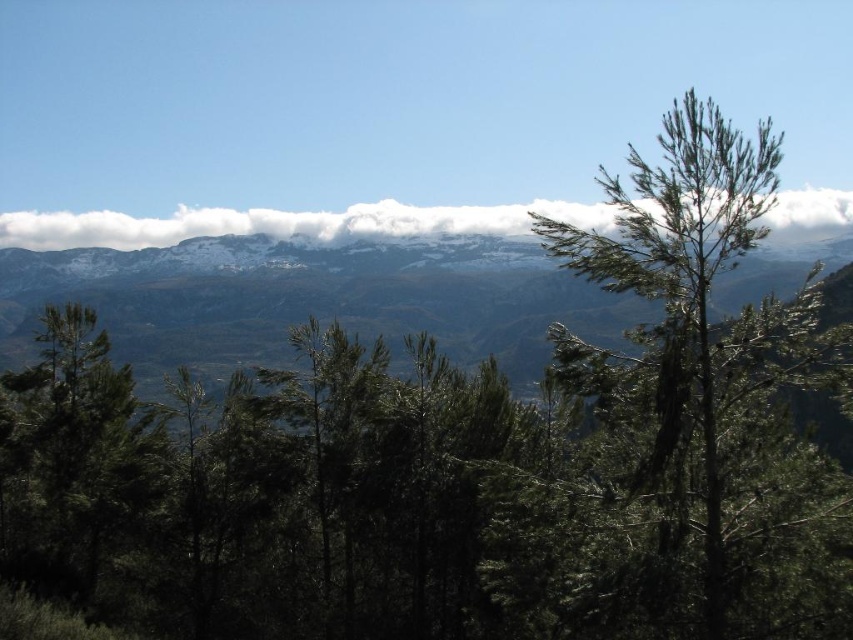
Question: Where is green needle-like tree at right located in relation to white fluffy cloud at upper center in the image?

Choices:
 (A) above
 (B) below

Answer: (A)

Question: Which point is closer to the camera?

Choices:
 (A) (367, 221)
 (B) (750, 164)

Answer: (B)

Question: Which point is closer to the camera taking this photo?

Choices:
 (A) (422, 236)
 (B) (662, 168)

Answer: (B)

Question: Is green needle-like tree at right closer to camera compared to white fluffy cloud at upper center?

Choices:
 (A) no
 (B) yes

Answer: (B)

Question: Observing the image, what is the correct spatial positioning of green needle-like tree at right in reference to white fluffy cloud at upper center?

Choices:
 (A) below
 (B) above

Answer: (B)